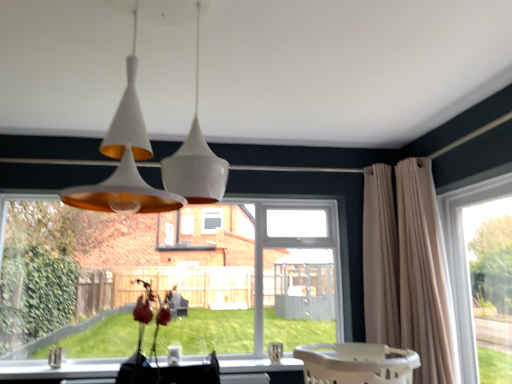
Describe the element at coordinates (380, 258) in the screenshot. I see `beige fabric curtain at right, which is the 2th curtain from right to left` at that location.

Measure the distance between beige plastic baby carriage at lower center and camera.

beige plastic baby carriage at lower center and camera are 1.51 meters apart from each other.

You are a GUI agent. You are given a task and a screenshot of the screen. Output one action in this format:
    pyautogui.click(x=<x>, y=<y>)
    Task: Click on the beige fabric curtain at right, acting as the 1th curtain starting from the right
    This screenshot has width=512, height=384.
    Given the screenshot: What is the action you would take?
    pyautogui.click(x=407, y=269)

What's the angular difference between white glossy pendant light at upper center and transparent glass window at right, which is the second window in left-to-right order,'s facing directions?

88.7 degrees separate the facing orientations of white glossy pendant light at upper center and transparent glass window at right, which is the second window in left-to-right order.

Which is more to the right, white glossy pendant light at upper center or transparent glass window at right, the first window when ordered from right to left?

transparent glass window at right, the first window when ordered from right to left, is more to the right.

Locate an element on the screen. lamp above the transparent glass window at right, which is the second window in left-to-right order (from the image's perspective) is located at coordinates (125, 160).

Considering the sizes of objects beige fabric curtain at right, marked as the 1th curtain in a left-to-right arrangement, and white glossy pendant light at upper center in the image provided, who is thinner, beige fabric curtain at right, marked as the 1th curtain in a left-to-right arrangement, or white glossy pendant light at upper center?

beige fabric curtain at right, marked as the 1th curtain in a left-to-right arrangement.

Can you see beige fabric curtain at right, which is the 2th curtain from right to left, touching white glossy pendant light at upper center?

No, beige fabric curtain at right, which is the 2th curtain from right to left, is not touching white glossy pendant light at upper center.

From the picture: Is beige fabric curtain at right, which is the 2th curtain from right to left, positioned with its back to white glossy pendant light at upper center?

No, white glossy pendant light at upper center is not at the back of beige fabric curtain at right, which is the 2th curtain from right to left.

Are beige plastic baby carriage at lower center and beige fabric curtain at right, which ranks as the 2th curtain in left-to-right order, located far from each other?

They are positioned close to each other.

Who is more distant, beige plastic baby carriage at lower center or beige fabric curtain at right, which ranks as the 2th curtain in left-to-right order?

beige fabric curtain at right, which ranks as the 2th curtain in left-to-right order, is further away from the camera.

Is beige plastic baby carriage at lower center oriented away from beige fabric curtain at right, which ranks as the 2th curtain in left-to-right order?

No, beige plastic baby carriage at lower center is not facing the opposite direction of beige fabric curtain at right, which ranks as the 2th curtain in left-to-right order.

In the scene shown: Is beige fabric curtain at right, acting as the 1th curtain starting from the right, inside beige plastic baby carriage at lower center?

That's incorrect, beige fabric curtain at right, acting as the 1th curtain starting from the right, is not inside beige plastic baby carriage at lower center.

Between clear glass window at lower left, marked as the second window in a right-to-left arrangement, and transparent glass window at right, which is the second window in left-to-right order, which one appears on the left side from the viewer's perspective?

Positioned to the left is clear glass window at lower left, marked as the second window in a right-to-left arrangement.

Is the position of clear glass window at lower left, marked as the second window in a right-to-left arrangement, more distant than that of transparent glass window at right, which is the second window in left-to-right order?

Yes.

Which of these two, clear glass window at lower left, marked as the second window in a right-to-left arrangement, or transparent glass window at right, the first window when ordered from right to left, stands taller?

transparent glass window at right, the first window when ordered from right to left, is taller.

Are clear glass window at lower left, positioned as the first window in left-to-right order, and transparent glass window at right, which is the second window in left-to-right order, far apart?

Yes, clear glass window at lower left, positioned as the first window in left-to-right order, and transparent glass window at right, which is the second window in left-to-right order, are quite far apart.

Relative to white glossy pendant light at upper center, is beige plastic baby carriage at lower center in front or behind?

In the image, beige plastic baby carriage at lower center appears behind white glossy pendant light at upper center.

From a real-world perspective, who is located higher, beige plastic baby carriage at lower center or white glossy pendant light at upper center?

white glossy pendant light at upper center.

Based on their positions, is beige plastic baby carriage at lower center located to the left or right of white glossy pendant light at upper center?

Based on their positions, beige plastic baby carriage at lower center is located to the right of white glossy pendant light at upper center.

Locate an element on the screen. This screenshot has height=384, width=512. baby carriage below the white glossy pendant light at upper center (from a real-world perspective) is located at coordinates (356, 363).

How many degrees apart are the facing directions of beige fabric curtain at right, acting as the 1th curtain starting from the right, and white glossy pendant light at upper center?

The angular difference between beige fabric curtain at right, acting as the 1th curtain starting from the right, and white glossy pendant light at upper center is 87.7 degrees.

Is beige fabric curtain at right, acting as the 1th curtain starting from the right, not near white glossy pendant light at upper center?

That's right, there is a large distance between beige fabric curtain at right, acting as the 1th curtain starting from the right, and white glossy pendant light at upper center.

Considering the relative sizes of beige fabric curtain at right, acting as the 1th curtain starting from the right, and white glossy pendant light at upper center in the image provided, is beige fabric curtain at right, acting as the 1th curtain starting from the right, wider than white glossy pendant light at upper center?

Incorrect, the width of beige fabric curtain at right, acting as the 1th curtain starting from the right, does not surpass that of white glossy pendant light at upper center.

From a real-world perspective, is beige fabric curtain at right, which ranks as the 2th curtain in left-to-right order, located higher than white glossy pendant light at upper center?

No, from a real-world perspective, beige fabric curtain at right, which ranks as the 2th curtain in left-to-right order, is not above white glossy pendant light at upper center.

Does point (444, 200) appear closer or farther from the camera than point (57, 212)?

Point (444, 200) appears to be closer to the viewer than point (57, 212).

Which object is wider, transparent glass window at right, the first window when ordered from right to left, or clear glass window at lower left, positioned as the first window in left-to-right order?

clear glass window at lower left, positioned as the first window in left-to-right order, is wider.

From the image's perspective, is transparent glass window at right, which is the second window in left-to-right order, located above or below clear glass window at lower left, marked as the second window in a right-to-left arrangement?

Clearly, from the image's perspective, transparent glass window at right, which is the second window in left-to-right order, is above clear glass window at lower left, marked as the second window in a right-to-left arrangement.

Is transparent glass window at right, the first window when ordered from right to left, far away from clear glass window at lower left, marked as the second window in a right-to-left arrangement?

transparent glass window at right, the first window when ordered from right to left, is far away from clear glass window at lower left, marked as the second window in a right-to-left arrangement.

Identify the location of lamp positioned vertically above the transparent glass window at right, which is the second window in left-to-right order (from a real-world perspective). (125, 160).

Identify the location of the 1st curtain counting from the right side of the white glossy pendant light at upper center. (380, 258).

Based on their spatial positions, is beige plastic baby carriage at lower center or beige fabric curtain at right, which is the 2th curtain from right to left, closer to clear glass window at lower left, positioned as the first window in left-to-right order?

Based on the image, beige fabric curtain at right, which is the 2th curtain from right to left, appears to be nearer to clear glass window at lower left, positioned as the first window in left-to-right order.

Estimate the real-world distances between objects in this image. Which object is closer to beige fabric curtain at right, marked as the 1th curtain in a left-to-right arrangement, beige plastic baby carriage at lower center or white glossy pendant light at upper center?

The object closer to beige fabric curtain at right, marked as the 1th curtain in a left-to-right arrangement, is beige plastic baby carriage at lower center.

From the image, which object appears to be farther from beige fabric curtain at right, marked as the 1th curtain in a left-to-right arrangement, transparent glass window at right, which is the second window in left-to-right order, or beige plastic baby carriage at lower center?

The object further to beige fabric curtain at right, marked as the 1th curtain in a left-to-right arrangement, is beige plastic baby carriage at lower center.

Based on their spatial positions, is beige fabric curtain at right, which is the 2th curtain from right to left, or beige plastic baby carriage at lower center closer to clear glass window at lower left, positioned as the first window in left-to-right order?

beige fabric curtain at right, which is the 2th curtain from right to left, lies closer to clear glass window at lower left, positioned as the first window in left-to-right order, than the other object.

Which object lies nearer to the anchor point transparent glass window at right, the first window when ordered from right to left, clear glass window at lower left, positioned as the first window in left-to-right order, or beige fabric curtain at right, which is the 2th curtain from right to left?

Among the two, beige fabric curtain at right, which is the 2th curtain from right to left, is located nearer to transparent glass window at right, the first window when ordered from right to left.

Looking at the image, which one is located further to clear glass window at lower left, positioned as the first window in left-to-right order, beige fabric curtain at right, acting as the 1th curtain starting from the right, or transparent glass window at right, the first window when ordered from right to left?

transparent glass window at right, the first window when ordered from right to left.

Estimate the real-world distances between objects in this image. Which object is closer to beige fabric curtain at right, acting as the 1th curtain starting from the right, beige plastic baby carriage at lower center or white glossy pendant light at upper center?

Among the two, beige plastic baby carriage at lower center is located nearer to beige fabric curtain at right, acting as the 1th curtain starting from the right.

From the picture: Looking at the image, which one is located closer to clear glass window at lower left, marked as the second window in a right-to-left arrangement, beige plastic baby carriage at lower center or white glossy pendant light at upper center?

beige plastic baby carriage at lower center is closer to clear glass window at lower left, marked as the second window in a right-to-left arrangement.

Where is `window located between beige plastic baby carriage at lower center and beige fabric curtain at right, which ranks as the 2th curtain in left-to-right order, in the depth direction`? window located between beige plastic baby carriage at lower center and beige fabric curtain at right, which ranks as the 2th curtain in left-to-right order, in the depth direction is located at coordinates (465, 262).

Where is `curtain between beige plastic baby carriage at lower center and beige fabric curtain at right, marked as the 1th curtain in a left-to-right arrangement, in the front-back direction`? Image resolution: width=512 pixels, height=384 pixels. curtain between beige plastic baby carriage at lower center and beige fabric curtain at right, marked as the 1th curtain in a left-to-right arrangement, in the front-back direction is located at coordinates (407, 269).

Where is `baby carriage between clear glass window at lower left, positioned as the first window in left-to-right order, and transparent glass window at right, which is the second window in left-to-right order, from left to right`? baby carriage between clear glass window at lower left, positioned as the first window in left-to-right order, and transparent glass window at right, which is the second window in left-to-right order, from left to right is located at coordinates coord(356,363).

At what (x,y) coordinates should I click in order to perform the action: click on curtain located between clear glass window at lower left, marked as the second window in a right-to-left arrangement, and beige fabric curtain at right, which ranks as the 2th curtain in left-to-right order, in the left-right direction. Please return your answer as a coordinate pair (x, y). Looking at the image, I should click on (380, 258).